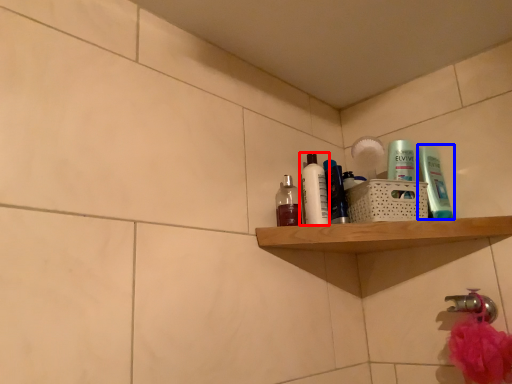
Question: Which of the following is the farthest to the observer, toiletry (highlighted by a red box) or toiletry (highlighted by a blue box)?

Choices:
 (A) toiletry
 (B) toiletry

Answer: (A)